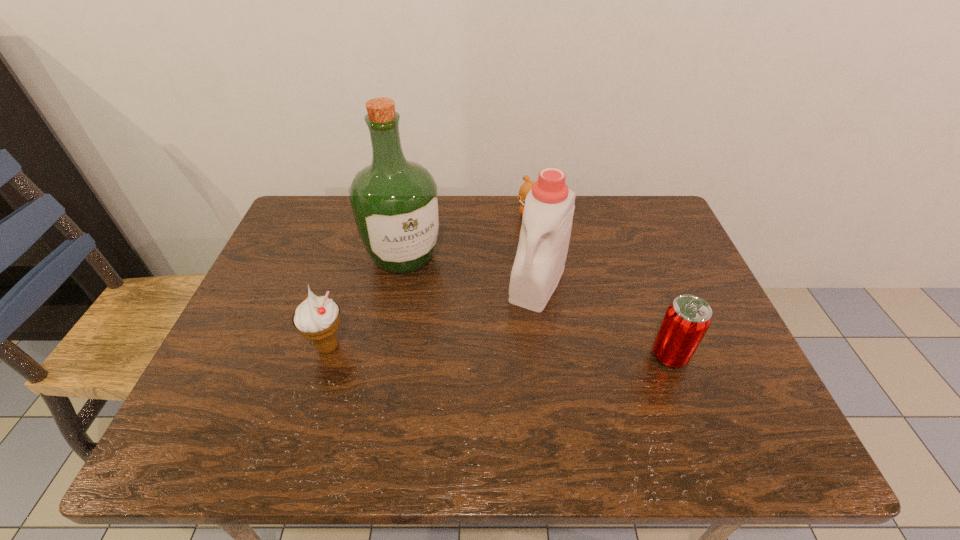
Find the location of `vacant space that's between the tallest object and the icecream`. vacant space that's between the tallest object and the icecream is located at coordinates (366, 302).

The width and height of the screenshot is (960, 540). Identify the location of object that is the second closest one to the icecream. (549, 206).

Image resolution: width=960 pixels, height=540 pixels. Find the location of `the fourth closest object to the teddy bear`. the fourth closest object to the teddy bear is located at coordinates (317, 318).

You are a GUI agent. You are given a task and a screenshot of the screen. Output one action in this format:
    pyautogui.click(x=<x>, y=<y>)
    Task: Click on the vacant area that satisfies the following two spatial constraints: 1. on the back side of the farthest object; 2. on the right side of the icecream
    
    Given the screenshot: What is the action you would take?
    pyautogui.click(x=369, y=215)